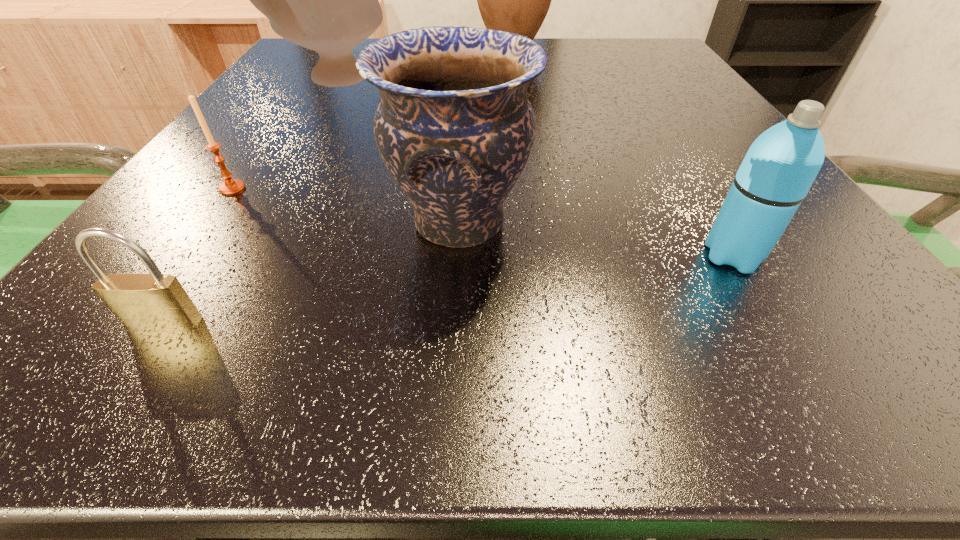
I want to click on empty location between the thermos bottle and the nearest object, so click(x=448, y=289).

Where is `blank region between the shorter pottery and the rightmost object`? blank region between the shorter pottery and the rightmost object is located at coordinates point(595,240).

Where is `free spot between the pitcher and the padlock`? The height and width of the screenshot is (540, 960). free spot between the pitcher and the padlock is located at coordinates (338, 187).

The image size is (960, 540). In order to click on free point between the nearest object and the farther pottery in this screenshot , I will do `click(251, 202)`.

The height and width of the screenshot is (540, 960). I want to click on free space between the right pottery and the nearest object, so click(x=312, y=273).

Identify the location of vacant area between the nearest object and the candle_holder. The width and height of the screenshot is (960, 540). (199, 255).

Identify the location of object that is the closest one to the pitcher. (326, 0).

Image resolution: width=960 pixels, height=540 pixels. Identify the location of the fourth closest object relative to the candle_holder. (516, 0).